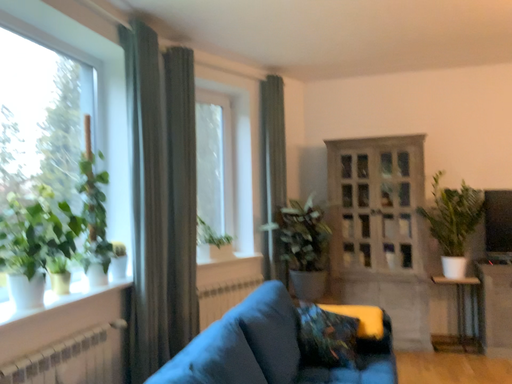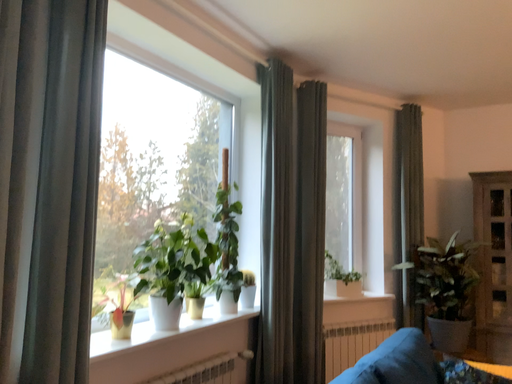
Question: How did the camera likely rotate when shooting the video?

Choices:
 (A) rotated right
 (B) rotated left

Answer: (B)